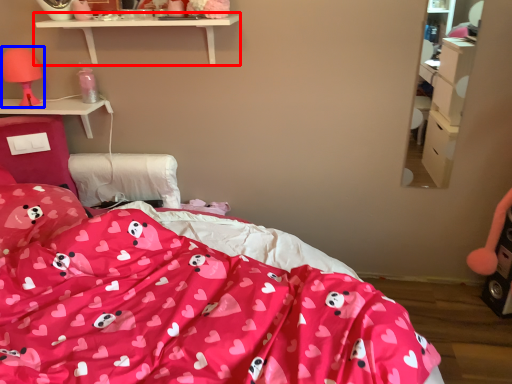
Question: Which object is further to the camera taking this photo, shelf (highlighted by a red box) or table lamp (highlighted by a blue box)?

Choices:
 (A) shelf
 (B) table lamp

Answer: (B)